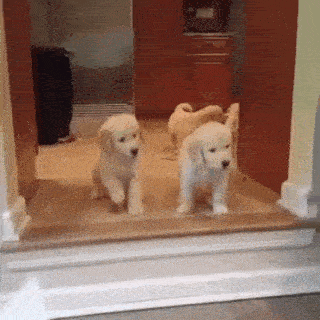
The height and width of the screenshot is (320, 320). Find the location of `wall`. wall is located at coordinates (302, 177).